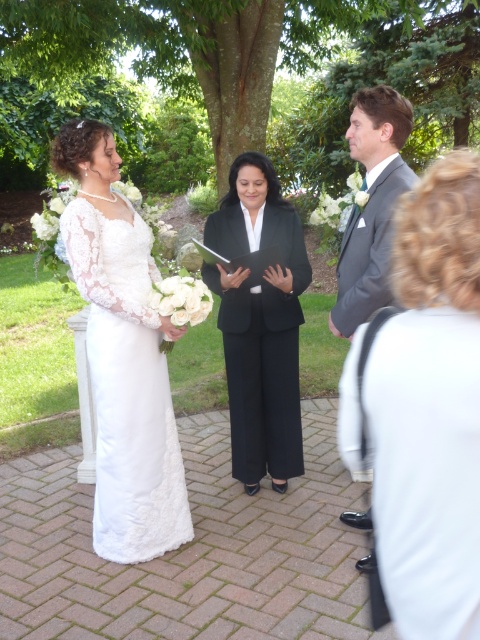
Can you confirm if satin black dress at center is positioned to the left of matte gray suit at center?

Yes, satin black dress at center is to the left of matte gray suit at center.

Image resolution: width=480 pixels, height=640 pixels. Describe the element at coordinates (424, 408) in the screenshot. I see `satin black dress at center` at that location.

At what (x,y) coordinates should I click in order to perform the action: click on satin black dress at center. Please return your answer as a coordinate pair (x, y). The width and height of the screenshot is (480, 640). Looking at the image, I should click on tap(424, 408).

The width and height of the screenshot is (480, 640). In order to click on satin black dress at center in this screenshot , I will do `click(424, 408)`.

Image resolution: width=480 pixels, height=640 pixels. In order to click on satin black dress at center in this screenshot , I will do `click(424, 408)`.

Based on the photo, is satin black dress at center taller than white lace dress at left?

In fact, satin black dress at center may be shorter than white lace dress at left.

Find the location of a particular element. The height and width of the screenshot is (640, 480). satin black dress at center is located at coordinates click(x=424, y=408).

Describe the element at coordinates (260, 323) in the screenshot. I see `black smooth suit at center` at that location.

Who is more distant from viewer, (x=255, y=444) or (x=363, y=164)?

The point (x=363, y=164) is more distant.

What are the coordinates of `black smooth suit at center` in the screenshot? It's located at (260, 323).